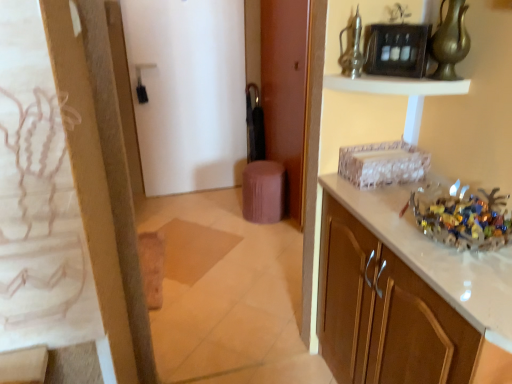
You are a GUI agent. You are given a task and a screenshot of the screen. Output one action in this format:
    pyautogui.click(x=<x>, y=<y>)
    Task: Click on the empty space that is ontop of white glossy cabinet at right
    
    Given the screenshot: What is the action you would take?
    pyautogui.click(x=416, y=231)